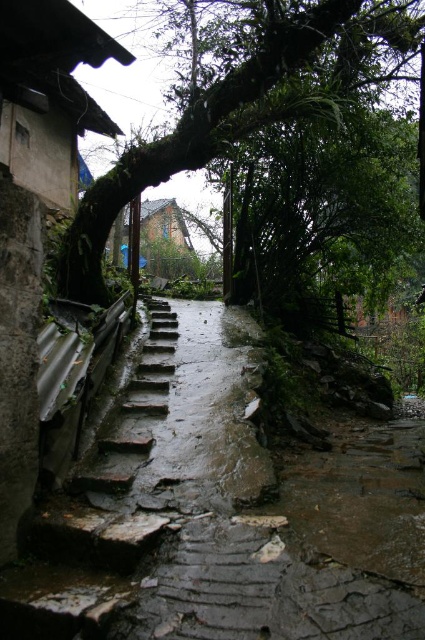
Is green mossy branch at upper center to the right of rusty stone stairs at left from the viewer's perspective?

Correct, you'll find green mossy branch at upper center to the right of rusty stone stairs at left.

Who is lower down, green mossy branch at upper center or rusty stone stairs at left?

rusty stone stairs at left is lower down.

Measure the distance between green mossy branch at upper center and camera.

The distance of green mossy branch at upper center from camera is 4.70 meters.

Where is `green mossy branch at upper center`? green mossy branch at upper center is located at coordinates (241, 100).